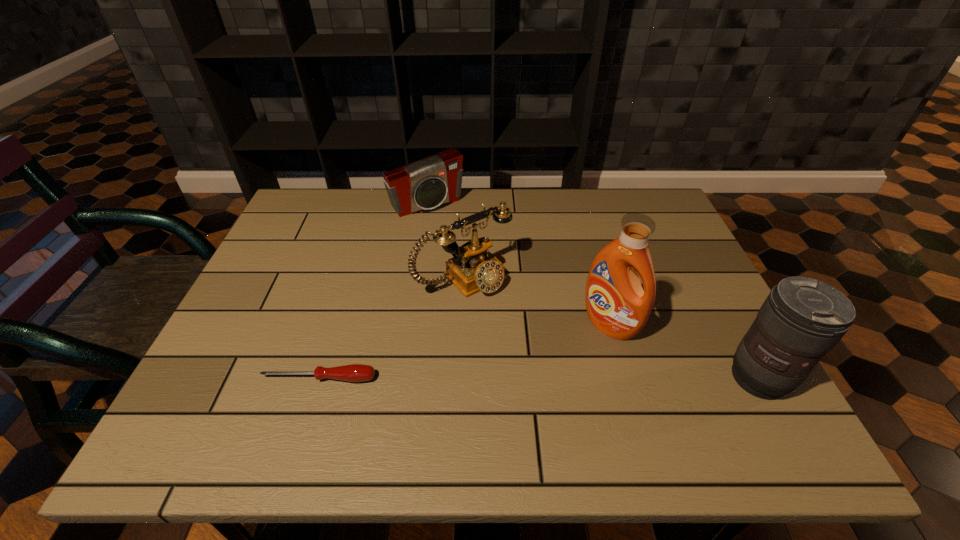
Find the location of `screwdriver`. screwdriver is located at coordinates (354, 372).

Find the location of a particular element. the rightmost object is located at coordinates (802, 319).

The height and width of the screenshot is (540, 960). In order to click on the fourth shortest object in this screenshot , I will do `click(802, 319)`.

Where is `camera`? camera is located at coordinates (436, 180).

You are a GUI agent. You are given a task and a screenshot of the screen. Output one action in this format:
    pyautogui.click(x=<x>, y=<y>)
    Task: Click on the farthest object
    The height and width of the screenshot is (540, 960).
    Given the screenshot: What is the action you would take?
    pyautogui.click(x=436, y=180)

Find the location of a particular element. This screenshot has width=960, height=540. the fourth object from left to right is located at coordinates (617, 305).

Find the location of a particular element. This screenshot has height=540, width=960. the third farthest object is located at coordinates (617, 305).

Find the location of a particular element. The width and height of the screenshot is (960, 540). the third tallest object is located at coordinates (473, 268).

Locate an element on the screen. This screenshot has height=540, width=960. telephone is located at coordinates 473,268.

What are the coordinates of `free space located on the front-facing side of the fourth tallest object` in the screenshot? It's located at (503, 295).